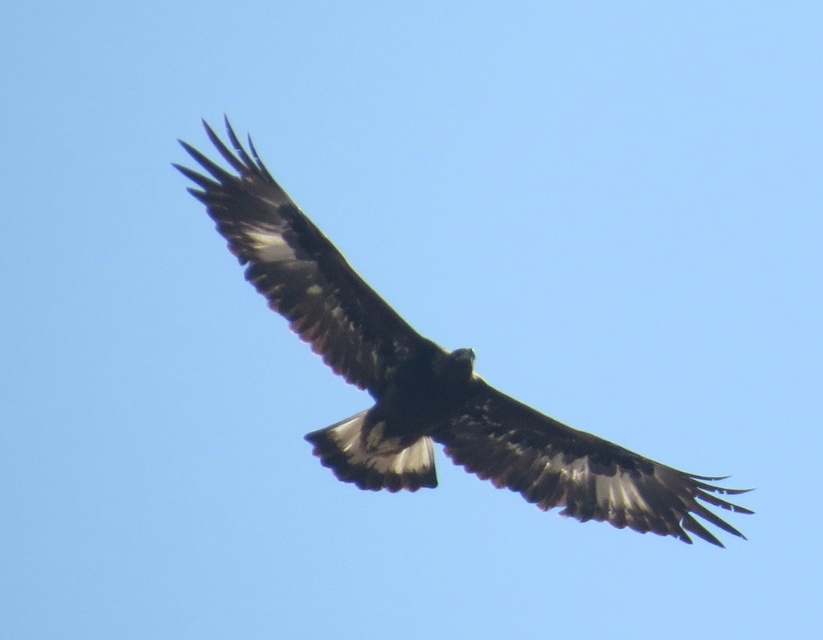
Can you confirm if brown feathered wing at center is positioned above dark brown feathered wing at center?

Correct, brown feathered wing at center is located above dark brown feathered wing at center.

Who is more distant from viewer, (229, 196) or (491, 416)?

The point (491, 416) is behind.

Is point (231, 218) positioned in front of point (561, 499)?

Yes, point (231, 218) is closer to viewer.

Locate an element on the screen. The height and width of the screenshot is (640, 823). brown feathered wing at center is located at coordinates (303, 272).

Who is more distant from viewer, (518, 481) or (611, 444)?

The point (518, 481) is behind.

Can you confirm if brown feathered eagle at center is thinner than dark brown feathered wing at center?

No, brown feathered eagle at center is not thinner than dark brown feathered wing at center.

Which is in front, point (247, 209) or point (704, 488)?

Point (247, 209) is in front.

Find the location of a particular element. Image resolution: width=823 pixels, height=640 pixels. brown feathered eagle at center is located at coordinates (426, 380).

Does brown feathered eagle at center have a larger size compared to brown feathered wing at center?

Yes.

This screenshot has width=823, height=640. Find the location of `brown feathered eagle at center`. brown feathered eagle at center is located at coordinates (426, 380).